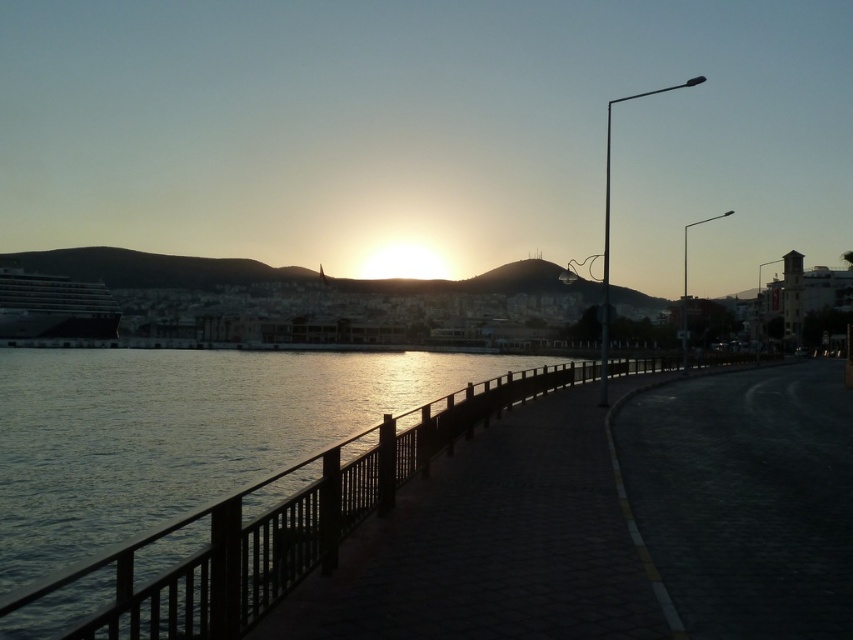
Question: Where is black wooden rail at center located in relation to dark gray metallic cruise ship at left in the image?

Choices:
 (A) above
 (B) below

Answer: (B)

Question: Does black wooden rail at center come behind dark gray metallic cruise ship at left?

Choices:
 (A) no
 (B) yes

Answer: (A)

Question: Which point is closer to the camera?

Choices:
 (A) dark gray metallic cruise ship at left
 (B) black wooden rail at center

Answer: (B)

Question: Which point is farther to the camera?

Choices:
 (A) black wooden rail at center
 (B) dark gray metallic cruise ship at left

Answer: (B)

Question: Which point is farther to the camera?

Choices:
 (A) (329, 515)
 (B) (86, 317)

Answer: (B)

Question: Does black wooden rail at center have a greater width compared to dark gray metallic cruise ship at left?

Choices:
 (A) yes
 (B) no

Answer: (A)